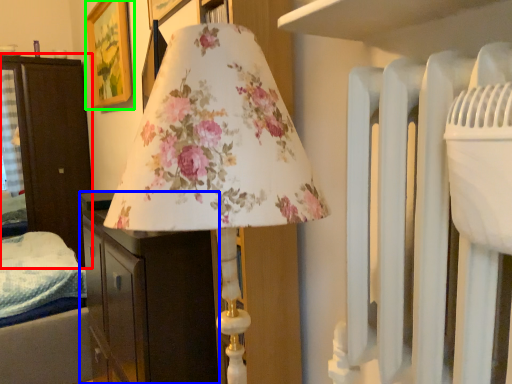
Question: Estimate the real-world distances between objects in this image. Which object is farther from furniture (highlighted by a red box), furniture (highlighted by a blue box) or picture frame (highlighted by a green box)?

Choices:
 (A) furniture
 (B) picture frame

Answer: (A)